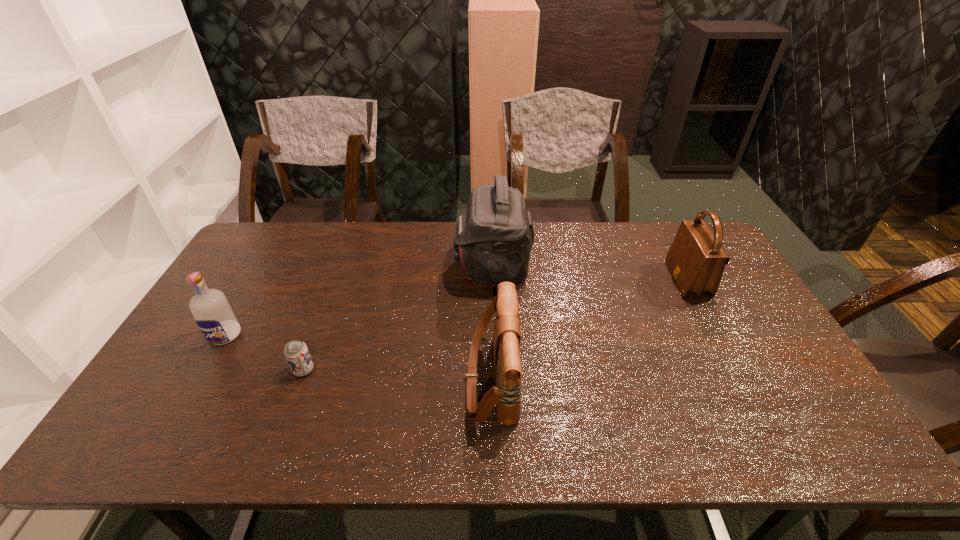
The width and height of the screenshot is (960, 540). Find the location of `the tallest object`. the tallest object is located at coordinates (493, 238).

Identify the location of the rightmost shoulder bag. (696, 260).

Locate an element on the screen. The height and width of the screenshot is (540, 960). vodka is located at coordinates (213, 314).

The height and width of the screenshot is (540, 960). What are the coordinates of `the nearest shoulder bag` in the screenshot? It's located at (506, 395).

This screenshot has width=960, height=540. In order to click on the fourth object from right to left in this screenshot , I will do (296, 352).

Locate an element on the screen. This screenshot has height=540, width=960. beer can is located at coordinates (296, 352).

Locate an element on the screen. This screenshot has height=540, width=960. vacant space located on the open flap of the tallest object is located at coordinates (367, 267).

Locate an element on the screen. blank area located on the open flap of the tallest object is located at coordinates (409, 267).

Identify the location of free space located 0.290m on the open flap of the tallest object. This screenshot has width=960, height=540. (367, 267).

You are a GUI agent. You are given a task and a screenshot of the screen. Output one action in this format:
    pyautogui.click(x=<x>, y=<y>)
    Task: Click on the free space located on the front flap of the rightmost shoulder bag
    The width and height of the screenshot is (960, 540).
    Given the screenshot: What is the action you would take?
    pyautogui.click(x=582, y=280)